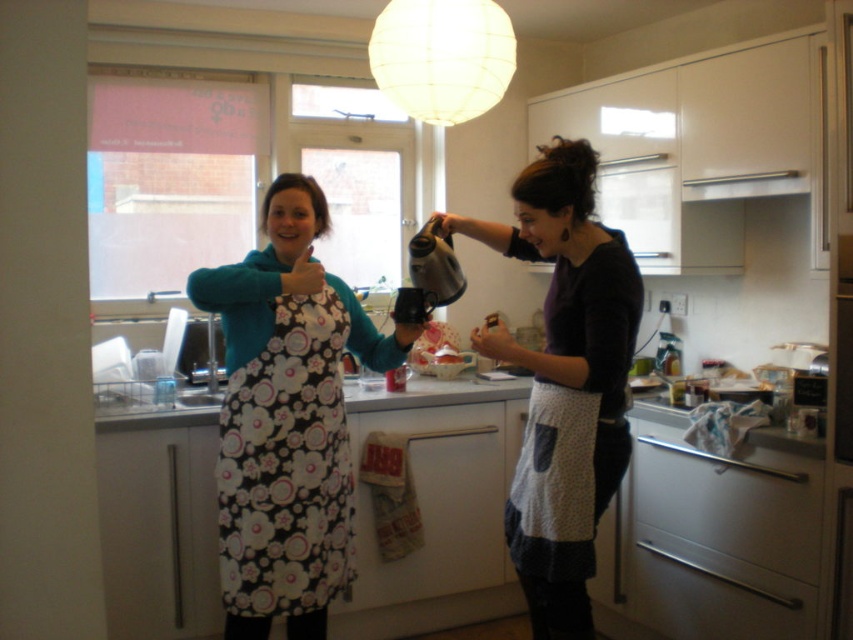
You are a chef standing in the kitchen and want to adjust the distance between the floral fabric apron at center and the white matte lampshade at upper center to 30 inches. Currently, the distance between them is 29.04 inches. Should you move the apron closer or farther away from the lampshade?

The floral fabric apron at center is currently 29.04 inches away from the white matte lampshade at upper center. To reach the desired 30 inches, you should move the apron farther away from the lampshade by approximately 0.96 inches.

You are a photographer setting up a shoot in this kitchen. You want to ensure the floral fabric apron at center is clearly visible without any obstruction from the white matte lampshade at upper center. Based on the scene description, is the current positioning of these items suitable for your needs?

Yes, the floral fabric apron at center is in front of the white matte lampshade at upper center, so it will be clearly visible without obstruction.